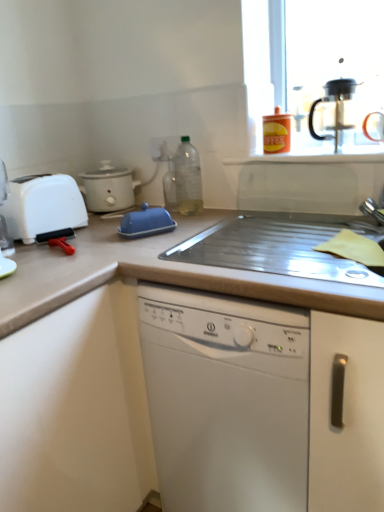
What do you see at coordinates (335, 106) in the screenshot? Image resolution: width=384 pixels, height=512 pixels. I see `black plastic coffee machine at upper right` at bounding box center [335, 106].

How much space does beige laminate countertop at center, which appears as the 2th countertop when viewed from the top, occupy vertically?

It is 35.80 inches.

Identify the location of beige laminate countertop at center, which appears as the 2th countertop when viewed from the top. The width and height of the screenshot is (384, 512). (183, 385).

What is the approximate width of white matte slow cooker at left, the third kitchen appliance viewed from the right?

It is 8.20 inches.

This screenshot has height=512, width=384. In order to click on transparent plastic bottle at center in this screenshot , I will do `click(163, 147)`.

The height and width of the screenshot is (512, 384). What do you see at coordinates (188, 178) in the screenshot? I see `translucent plastic bottle at center` at bounding box center [188, 178].

The image size is (384, 512). I want to click on white plastic toaster at left, so point(43,206).

From the picture: Would you say metallic silver sink at center, which is the 2th countertop in bottom-to-top order, is to the left or to the right of beige laminate countertop at center, which appears as the 2th countertop when viewed from the top, in the picture?

Clearly, metallic silver sink at center, which is the 2th countertop in bottom-to-top order, is on the right of beige laminate countertop at center, which appears as the 2th countertop when viewed from the top, in the image.

From a real-world perspective, who is located higher, metallic silver sink at center, acting as the 1th countertop starting from the top, or beige laminate countertop at center, which is the 1th countertop in bottom-to-top order?

metallic silver sink at center, acting as the 1th countertop starting from the top, is physically above.

Is point (103, 226) positioned after point (13, 367)?

Yes, it is.

Does metallic silver sink at center, acting as the 1th countertop starting from the top, touch beige laminate countertop at center, which is the 1th countertop in bottom-to-top order?

No.

From a real-world perspective, is orange matte coffee canister at upper right, the 1th kitchen appliance from the right, on top of translucent plastic bottle at center?

Correct, in the physical world, orange matte coffee canister at upper right, the 1th kitchen appliance from the right, is higher than translucent plastic bottle at center.

Is point (267, 146) farther from camera compared to point (186, 153)?

No, it is in front of (186, 153).

Looking at this image, is orange matte coffee canister at upper right, which appears as the 2th kitchen appliance when viewed from the back, next to translucent plastic bottle at center?

No, orange matte coffee canister at upper right, which appears as the 2th kitchen appliance when viewed from the back, is not next to translucent plastic bottle at center.

Does white plastic toaster at left turn towards black plastic coffee machine at upper right?

No, white plastic toaster at left is not oriented towards black plastic coffee machine at upper right.

Can you confirm if white plastic toaster at left is wider than black plastic coffee machine at upper right?

Yes, white plastic toaster at left is wider than black plastic coffee machine at upper right.

Considering the sizes of objects white plastic toaster at left and black plastic coffee machine at upper right in the image provided, who is shorter, white plastic toaster at left or black plastic coffee machine at upper right?

white plastic toaster at left.

Measure the distance from white plastic toaster at left to white matte slow cooker at left, the third kitchen appliance viewed from the right.

white plastic toaster at left and white matte slow cooker at left, the third kitchen appliance viewed from the right, are 9.29 inches apart from each other.

From a real-world perspective, is white plastic toaster at left on top of white matte slow cooker at left, marked as the first kitchen appliance in a back-to-front arrangement?

No, from a real-world perspective, white plastic toaster at left is not over white matte slow cooker at left, marked as the first kitchen appliance in a back-to-front arrangement

Would you consider white plastic toaster at left to be distant from white matte slow cooker at left, the third kitchen appliance viewed from the right?

They are positioned close to each other.

Is white plastic toaster at left bigger than white matte slow cooker at left, which ranks as the first kitchen appliance in left-to-right order?

Yes, white plastic toaster at left is bigger than white matte slow cooker at left, which ranks as the first kitchen appliance in left-to-right order.

From a real-world perspective, is matte plastic container at upper right physically located above or below white matte cabinet at lower left?

From a real-world perspective, matte plastic container at upper right is physically above white matte cabinet at lower left.

Considering the sizes of objects matte plastic container at upper right and white matte cabinet at lower left in the image provided, who is taller, matte plastic container at upper right or white matte cabinet at lower left?

white matte cabinet at lower left.

Is white matte cabinet at lower left located within matte plastic container at upper right?

No.

Between matte plastic container at upper right and white matte cabinet at lower left, which one has larger width?

white matte cabinet at lower left.

From a real-world perspective, is white matte slow cooker at left, which ranks as the first kitchen appliance in left-to-right order, under translucent plastic bottle at center?

Yes.

Can you confirm if white matte slow cooker at left, marked as the first kitchen appliance in a back-to-front arrangement, is positioned to the left of translucent plastic bottle at center?

Indeed, white matte slow cooker at left, marked as the first kitchen appliance in a back-to-front arrangement, is positioned on the left side of translucent plastic bottle at center.

From the picture: Is white matte slow cooker at left, the third kitchen appliance viewed from the right, oriented towards translucent plastic bottle at center?

Yes, white matte slow cooker at left, the third kitchen appliance viewed from the right, is oriented towards translucent plastic bottle at center.

Who is more distant, white matte slow cooker at left, which ranks as the 3th kitchen appliance in front-to-back order, or translucent plastic bottle at center?

Positioned behind is white matte slow cooker at left, which ranks as the 3th kitchen appliance in front-to-back order.

Which object is more forward, white matte slow cooker at left, which ranks as the 3th kitchen appliance in front-to-back order, or black plastic coffee machine at upper right?

black plastic coffee machine at upper right.

From a real-world perspective, between white matte slow cooker at left, which ranks as the first kitchen appliance in left-to-right order, and black plastic coffee machine at upper right, who is vertically lower?

white matte slow cooker at left, which ranks as the first kitchen appliance in left-to-right order, is physically lower.

From a real-world perspective, which kitchen appliance is the 2nd one underneath the black plastic coffee machine at upper right? Please provide its 2D coordinates.

[(108, 188)]

Which object is wider, white matte slow cooker at left, marked as the first kitchen appliance in a back-to-front arrangement, or black plastic coffee machine at upper right?

Wider between the two is white matte slow cooker at left, marked as the first kitchen appliance in a back-to-front arrangement.

Identify the location of countertop in front of the metallic silver sink at center, acting as the 1th countertop starting from the top. (183, 385).

Find the location of `kitchen appliance that appears above the translucent plastic bottle at center (from a real-world perspective)`. kitchen appliance that appears above the translucent plastic bottle at center (from a real-world perspective) is located at coordinates (276, 132).

From the image, which object appears to be farther from blue plastic butter dish at center, placed as the third kitchen appliance when sorted from back to front, white matte cabinet at lower left or translucent plastic bottle at center?

The object further to blue plastic butter dish at center, placed as the third kitchen appliance when sorted from back to front, is white matte cabinet at lower left.

From the image, which object appears to be farther from orange matte coffee canister at upper right, which appears as the 2th kitchen appliance when viewed from the back, matte plastic container at upper right or metallic silver sink at center, which is the 2th countertop in bottom-to-top order?

metallic silver sink at center, which is the 2th countertop in bottom-to-top order, is positioned further to the anchor orange matte coffee canister at upper right, which appears as the 2th kitchen appliance when viewed from the back.

Based on their spatial positions, is matte plastic container at upper right or blue plastic butter dish at center, which is the 2th kitchen appliance in left-to-right order, further from translucent plastic bottle at center?

Based on the image, matte plastic container at upper right appears to be further to translucent plastic bottle at center.

From the image, which object appears to be nearer to orange matte coffee canister at upper right, which appears as the 2th kitchen appliance when viewed from the back, white matte slow cooker at left, which ranks as the first kitchen appliance in left-to-right order, or transparent plastic bottle at center?

The object closer to orange matte coffee canister at upper right, which appears as the 2th kitchen appliance when viewed from the back, is transparent plastic bottle at center.

When comparing their distances from beige laminate countertop at center, which is the 1th countertop in bottom-to-top order, does orange matte coffee canister at upper right, which appears as the 2th kitchen appliance when viewed from the back, or white plastic toaster at left seem further?

orange matte coffee canister at upper right, which appears as the 2th kitchen appliance when viewed from the back, is further to beige laminate countertop at center, which is the 1th countertop in bottom-to-top order.

Which object lies nearer to the anchor point white plastic toaster at left, blue plastic butter dish at center, placed as the 2th kitchen appliance when sorted from right to left, or black plastic coffee machine at upper right?

Among the two, blue plastic butter dish at center, placed as the 2th kitchen appliance when sorted from right to left, is located nearer to white plastic toaster at left.

From the image, which object appears to be farther from white plastic toaster at left, white matte slow cooker at left, the third kitchen appliance viewed from the right, or metallic silver sink at center, which is the 2th countertop in bottom-to-top order?

Among the two, metallic silver sink at center, which is the 2th countertop in bottom-to-top order, is located further to white plastic toaster at left.

Looking at the image, which one is located closer to metallic silver sink at center, which is the 2th countertop in bottom-to-top order, white matte slow cooker at left, the third kitchen appliance viewed from the right, or transparent plastic bottle at center?

Among the two, white matte slow cooker at left, the third kitchen appliance viewed from the right, is located nearer to metallic silver sink at center, which is the 2th countertop in bottom-to-top order.

I want to click on kitchen appliance between translucent plastic bottle at center and white matte cabinet at lower left from top to bottom, so click(x=145, y=222).

This screenshot has height=512, width=384. What are the coordinates of `countertop between orange matte coffee canister at upper right, the 1th kitchen appliance from the right, and beige laminate countertop at center, which is the 1th countertop in bottom-to-top order, from top to bottom` in the screenshot? It's located at pos(158,275).

Locate an element on the screen. This screenshot has height=512, width=384. kitchen appliance between white plastic toaster at left and white matte cabinet at lower left vertically is located at coordinates (145, 222).

Find the location of a particular element. electric outlet between white plastic toaster at left and black plastic coffee machine at upper right in the horizontal direction is located at coordinates (163, 147).